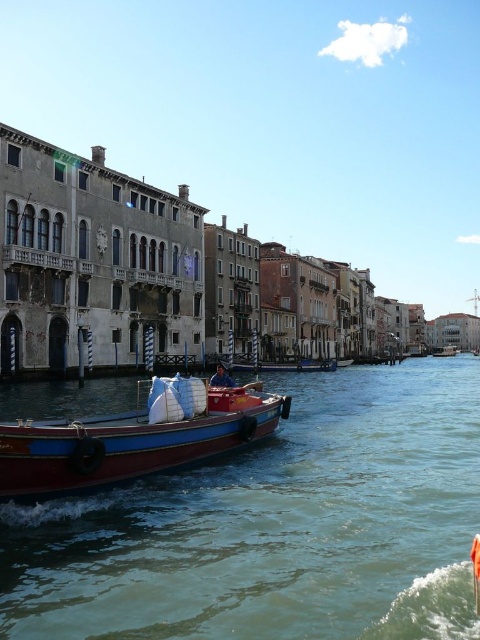
You are a tourist in Venice and want to take a boat ride. You see two wooden boats available for rent. The first is the wooden boat at center and the second is the wooden boat at right. Which boat is narrower?

The wooden boat at center is thinner than the wooden boat at right, so the wooden boat at center is narrower.

Looking at this image, you are standing on the historic building on the left side of the canal and want to reach the wooden boat at center. Which direction should you move to reach it?

Since the wooden boat at center is located at coordinates point (133, 440), you should move towards the center of the canal from the historic building on the left side to reach it.